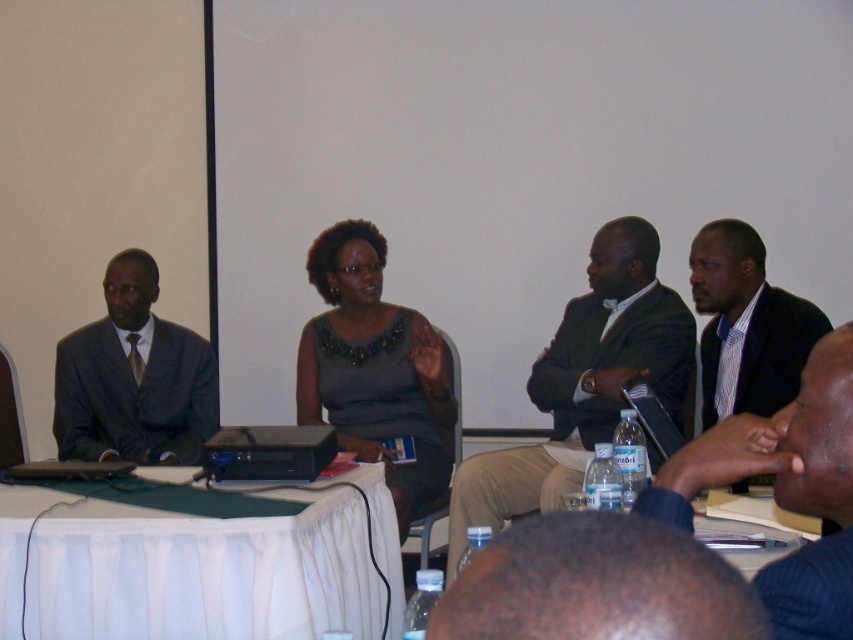
Is point (392, 364) less distant than point (734, 340)?

No.

Can you confirm if dark gray dress at center is positioned above striped cotton shirt at right?

Actually, dark gray dress at center is below striped cotton shirt at right.

Where is `dark gray dress at center`? Image resolution: width=853 pixels, height=640 pixels. dark gray dress at center is located at coordinates (375, 371).

Which is in front, point (398, 566) or point (576, 513)?

Point (576, 513) is more forward.

The height and width of the screenshot is (640, 853). Identify the location of white fabric table at lower center. (198, 563).

Is point (206, 392) positioned in front of point (761, 244)?

No, (206, 392) is behind (761, 244).

Does matte black suit at left have a larger size compared to striped cotton shirt at right?

Correct, matte black suit at left is larger in size than striped cotton shirt at right.

From the picture: Measure the distance between matte black suit at left and camera.

A distance of 3.32 meters exists between matte black suit at left and camera.

This screenshot has width=853, height=640. I want to click on matte black suit at left, so click(132, 378).